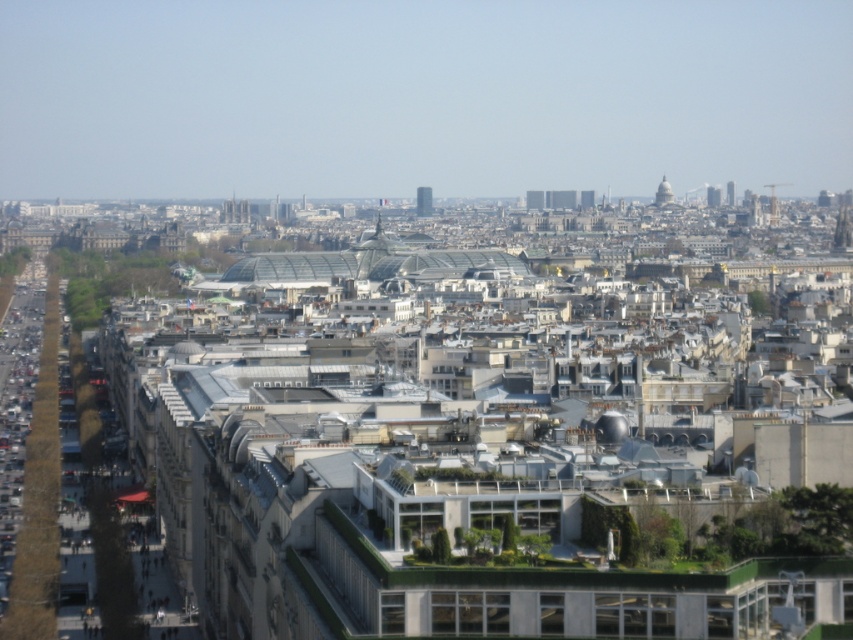
Looking at this image, can you confirm if green glass tower at center is positioned to the right of smooth glass skyscraper at upper right?

No, green glass tower at center is not to the right of smooth glass skyscraper at upper right.

Describe the element at coordinates (422, 202) in the screenshot. The image size is (853, 640). I see `green glass tower at center` at that location.

Where is `green glass tower at center`? This screenshot has width=853, height=640. green glass tower at center is located at coordinates (422, 202).

The width and height of the screenshot is (853, 640). I want to click on green glass tower at center, so click(422, 202).

Can you confirm if smooth glass spire at upper center is shorter than smooth glass skyscraper at upper right?

Yes, smooth glass spire at upper center is shorter than smooth glass skyscraper at upper right.

This screenshot has height=640, width=853. I want to click on smooth glass spire at upper center, so click(663, 193).

At what (x,y) coordinates should I click in order to perform the action: click on smooth glass spire at upper center. Please return your answer as a coordinate pair (x, y). The width and height of the screenshot is (853, 640). Looking at the image, I should click on click(x=663, y=193).

Does matte glass spire at upper right appear on the right side of smooth glass skyscraper at upper right?

Incorrect, matte glass spire at upper right is not on the right side of smooth glass skyscraper at upper right.

Does matte glass spire at upper right appear under smooth glass skyscraper at upper right?

Correct, matte glass spire at upper right is located below smooth glass skyscraper at upper right.

Who is more distant from viewer, (715, 202) or (730, 198)?

Positioned behind is point (715, 202).

Identify the location of matte glass spire at upper right. Image resolution: width=853 pixels, height=640 pixels. (712, 196).